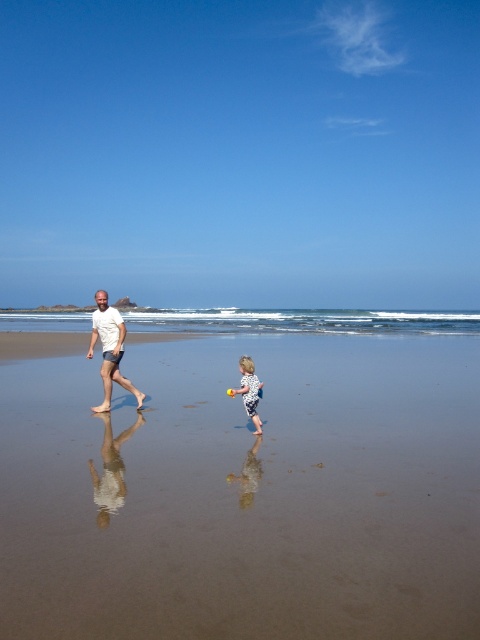
You are a photographer trying to capture the clear blue water at center and the white dotted swimsuit at lower center in the same frame. Based on their positions, which object is located to the left of the other?

The clear blue water at center is positioned on the left side of white dotted swimsuit at lower center.

You are a photographer wanting to capture the smooth sand at center and the white dotted swimsuit at lower center in the same frame. Based on their positions, which object should you focus on first to ensure both are in the shot?

The smooth sand at center is to the left of the white dotted swimsuit at lower center, so focusing on the white dotted swimsuit at lower center first would allow you to frame both objects effectively.

You are standing at the beach and see two points marked in the image. Which point is closer to you, point (94, 312) or point (251, 372)?

Point (94, 312) is closer to you because it is further to the camera than point (251, 372).